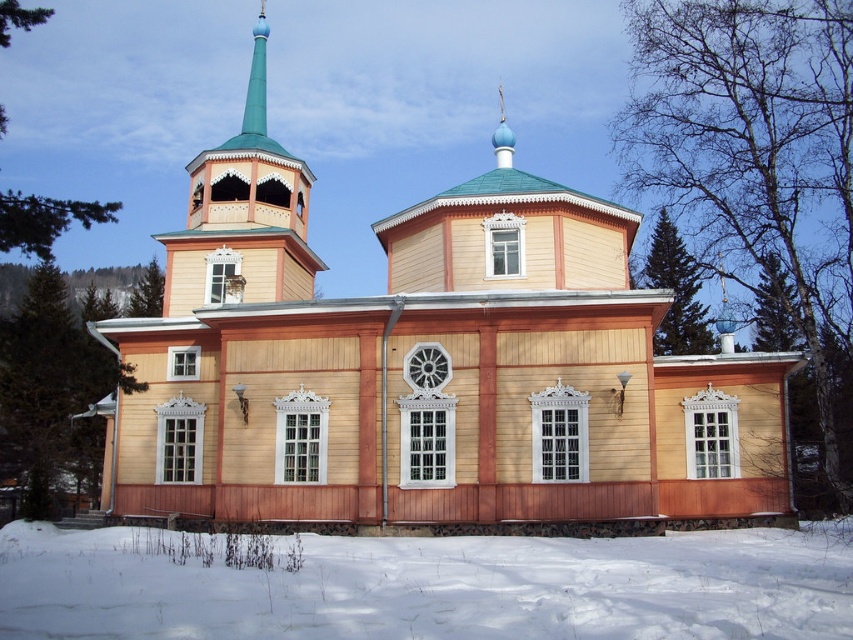
In the scene shown: Is wooden church at center above white powdery snow at lower center?

Yes.

Can you confirm if wooden church at center is shorter than white powdery snow at lower center?

Incorrect, wooden church at center's height does not fall short of white powdery snow at lower center's.

Locate an element on the screen. This screenshot has width=853, height=640. wooden church at center is located at coordinates (428, 365).

Where is `wooden church at center`? The height and width of the screenshot is (640, 853). wooden church at center is located at coordinates (428, 365).